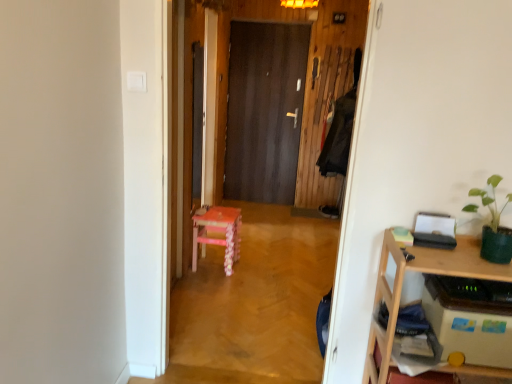
What do you see at coordinates (218, 232) in the screenshot? This screenshot has height=384, width=512. I see `pink wood stool at center` at bounding box center [218, 232].

Locate an element on the screen. dark wood door at center is located at coordinates (264, 110).

What is the approximate width of wooden desk at right?

wooden desk at right is 34.03 centimeters in width.

Looking at this image, what is the approximate width of pink wood chair at center?

It is 4.47 inches.

Find the location of a particular element. The image size is (512, 384). pink wood chair at center is located at coordinates (256, 302).

The height and width of the screenshot is (384, 512). Find the location of `pink wood stool at center`. pink wood stool at center is located at coordinates (218, 232).

Considering the positions of objects dark wood door at center and wooden desk at right in the image provided, who is more to the left, dark wood door at center or wooden desk at right?

Positioned to the left is dark wood door at center.

Is point (249, 40) positioned after point (392, 296)?

That is True.

Does dark wood door at center lie behind wooden desk at right?

Yes, the depth of dark wood door at center is greater than that of wooden desk at right.

This screenshot has width=512, height=384. Find the location of `desk located below the dark wood door at center (from the image's perspective)`. desk located below the dark wood door at center (from the image's perspective) is located at coordinates (422, 272).

Considering the sizes of objects green matte plant at upper right and wooden desk at right in the image provided, who is bigger, green matte plant at upper right or wooden desk at right?

With larger size is wooden desk at right.

Identify the location of desk on the left of green matte plant at upper right. (422, 272).

Are green matte plant at upper right and wooden desk at right far apart?

green matte plant at upper right is actually quite close to wooden desk at right.

Which is further, [495,237] or [397,302]?

Point [397,302]

From the image's perspective, which one is positioned higher, dark wood door at center or pink wood stool at center?

dark wood door at center is shown above in the image.

Which object is positioned more to the left, dark wood door at center or pink wood stool at center?

From the viewer's perspective, pink wood stool at center appears more on the left side.

Is dark wood door at center with pink wood stool at center?

There is a gap between dark wood door at center and pink wood stool at center.

What's the angular difference between dark wood door at center and pink wood stool at center's facing directions?

87.1 degrees.

Is green matte plant at upper right looking in the opposite direction of pink wood chair at center?

No, green matte plant at upper right is not facing the opposite direction of pink wood chair at center.

There is a pink wood chair at center. Find the location of `houseplant above it (from a real-world perspective)`. houseplant above it (from a real-world perspective) is located at coordinates (494, 225).

Is green matte plant at upper right taller than pink wood chair at center?

In fact, green matte plant at upper right may be shorter than pink wood chair at center.

Considering the relative sizes of green matte plant at upper right and pink wood chair at center in the image provided, is green matte plant at upper right bigger than pink wood chair at center?

No.

Based on the photo, can you confirm if green matte plant at upper right is shorter than pink wood stool at center?

Correct, green matte plant at upper right is not as tall as pink wood stool at center.

From a real-world perspective, is green matte plant at upper right positioned under pink wood stool at center based on gravity?

No.

Is green matte plant at upper right wider or thinner than pink wood stool at center?

Clearly, green matte plant at upper right has less width compared to pink wood stool at center.

From the image's perspective, is pink wood chair at center below green matte plant at upper right?

No, from the image's perspective, pink wood chair at center is not beneath green matte plant at upper right.

Considering the sizes of pink wood chair at center and green matte plant at upper right in the image, is pink wood chair at center bigger or smaller than green matte plant at upper right?

Clearly, pink wood chair at center is larger in size than green matte plant at upper right.

Is pink wood chair at center outside of green matte plant at upper right?

Absolutely, pink wood chair at center is external to green matte plant at upper right.

Is pink wood chair at center positioned far away from green matte plant at upper right?

Yes, pink wood chair at center is far from green matte plant at upper right.

From a real-world perspective, between pink wood stool at center and green matte plant at upper right, who is vertically lower?

pink wood stool at center.

In terms of height, does pink wood stool at center look taller or shorter compared to green matte plant at upper right?

In the image, pink wood stool at center appears to be taller than green matte plant at upper right.

Considering the positions of point (229, 225) and point (490, 216), is point (229, 225) closer or farther from the camera than point (490, 216)?

Point (229, 225).

Where is `desk lying in front of the dark wood door at center`? This screenshot has width=512, height=384. desk lying in front of the dark wood door at center is located at coordinates (422, 272).

Find the location of a particular element. The image size is (512, 384). houseplant lying on the right of wooden desk at right is located at coordinates (494, 225).

Which object lies nearer to the anchor point pink wood stool at center, green matte plant at upper right or wooden desk at right?

wooden desk at right lies closer to pink wood stool at center than the other object.

Considering their positions, is dark wood door at center positioned closer to pink wood chair at center than pink wood stool at center?

pink wood stool at center.

Estimate the real-world distances between objects in this image. Which object is closer to dark wood door at center, pink wood chair at center or wooden desk at right?

The object closer to dark wood door at center is pink wood chair at center.

Consider the image. Considering their positions, is pink wood stool at center positioned further to pink wood chair at center than green matte plant at upper right?

Among the two, green matte plant at upper right is located further to pink wood chair at center.

When comparing their distances from wooden desk at right, does green matte plant at upper right or dark wood door at center seem further?

dark wood door at center is further to wooden desk at right.

Estimate the real-world distances between objects in this image. Which object is further from pink wood chair at center, green matte plant at upper right or dark wood door at center?

green matte plant at upper right.

Which object lies further to the anchor point pink wood stool at center, wooden desk at right or green matte plant at upper right?

green matte plant at upper right.

Based on their spatial positions, is pink wood chair at center or pink wood stool at center closer to dark wood door at center?

Based on the image, pink wood chair at center appears to be nearer to dark wood door at center.

The height and width of the screenshot is (384, 512). Find the location of `corridor between green matte plant at upper right and pink wood stool at center from front to back`. corridor between green matte plant at upper right and pink wood stool at center from front to back is located at coordinates (256, 302).

Locate an element on the screen. This screenshot has width=512, height=384. stool between pink wood chair at center and dark wood door at center in the front-back direction is located at coordinates (218, 232).

Find the location of a particular element. stool located between green matte plant at upper right and dark wood door at center in the depth direction is located at coordinates (218, 232).

Locate an element on the screen. This screenshot has height=384, width=512. corridor between wooden desk at right and dark wood door at center along the z-axis is located at coordinates (256, 302).